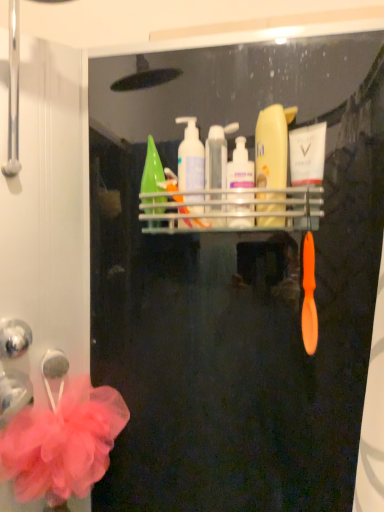
Question: Which direction should I rotate to look at translucent plastic pump bottle at upper center, the 3th cleaning product positioned from the right?

Choices:
 (A) right
 (B) left

Answer: (B)

Question: From the image's perspective, does pink mesh flower at lower left appear higher than white glossy mouthwash at upper center, the first mouthwash from the right?

Choices:
 (A) no
 (B) yes

Answer: (A)

Question: Is white glossy mouthwash at upper center, the first mouthwash from the right, at the back of pink mesh flower at lower left?

Choices:
 (A) no
 (B) yes

Answer: (A)

Question: Can you confirm if pink mesh flower at lower left is taller than white glossy mouthwash at upper center, which is the second mouthwash from left to right?

Choices:
 (A) no
 (B) yes

Answer: (B)

Question: Is pink mesh flower at lower left at the right side of white glossy mouthwash at upper center, the first mouthwash from the right?

Choices:
 (A) yes
 (B) no

Answer: (B)

Question: Is pink mesh flower at lower left at the left side of white glossy mouthwash at upper center, the first mouthwash from the right?

Choices:
 (A) no
 (B) yes

Answer: (B)

Question: Can you confirm if pink mesh flower at lower left is shorter than white glossy mouthwash at upper center, which is the second mouthwash from left to right?

Choices:
 (A) yes
 (B) no

Answer: (B)

Question: Is pink mesh flower at lower left far from green matte bottle at center, positioned as the fourth cleaning product in right-to-left order?

Choices:
 (A) no
 (B) yes

Answer: (A)

Question: Is pink mesh flower at lower left oriented towards green matte bottle at center, which ranks as the 1th cleaning product in left-to-right order?

Choices:
 (A) no
 (B) yes

Answer: (A)

Question: Is pink mesh flower at lower left smaller than green matte bottle at center, which ranks as the 1th cleaning product in left-to-right order?

Choices:
 (A) no
 (B) yes

Answer: (A)

Question: From the image's perspective, is pink mesh flower at lower left located above green matte bottle at center, positioned as the fourth cleaning product in right-to-left order?

Choices:
 (A) yes
 (B) no

Answer: (B)

Question: From a real-world perspective, is pink mesh flower at lower left under green matte bottle at center, which ranks as the 1th cleaning product in left-to-right order?

Choices:
 (A) no
 (B) yes

Answer: (B)

Question: Is pink mesh flower at lower left shorter than green matte bottle at center, which ranks as the 1th cleaning product in left-to-right order?

Choices:
 (A) no
 (B) yes

Answer: (A)

Question: Is the depth of translucent plastic pump bottle at upper center, the second cleaning product positioned from the left, less than that of matte yellow bottle at center, marked as the 4th cleaning product in a left-to-right arrangement?

Choices:
 (A) yes
 (B) no

Answer: (B)